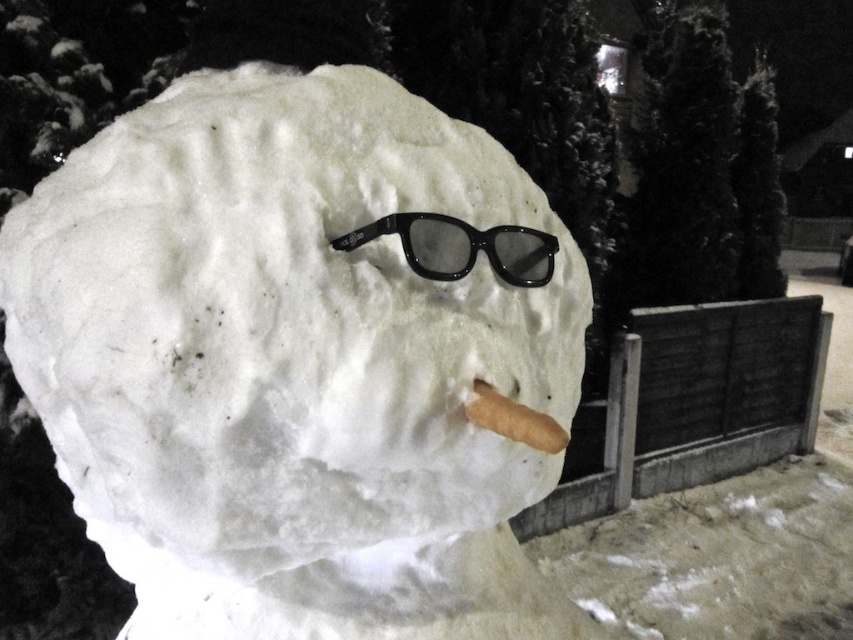
Question: Does white fluffy snowman at center have a larger size compared to black plastic goggles at center?

Choices:
 (A) no
 (B) yes

Answer: (B)

Question: Which object is farther from the camera taking this photo?

Choices:
 (A) white fluffy snowman at center
 (B) black plastic goggles at center

Answer: (B)

Question: Is white fluffy snowman at center smaller than black plastic goggles at center?

Choices:
 (A) yes
 (B) no

Answer: (B)

Question: In this image, where is white fluffy snowman at center located relative to black plastic goggles at center?

Choices:
 (A) left
 (B) right

Answer: (A)

Question: Which point is farther from the camera taking this photo?

Choices:
 (A) (541, 259)
 (B) (392, 404)

Answer: (A)